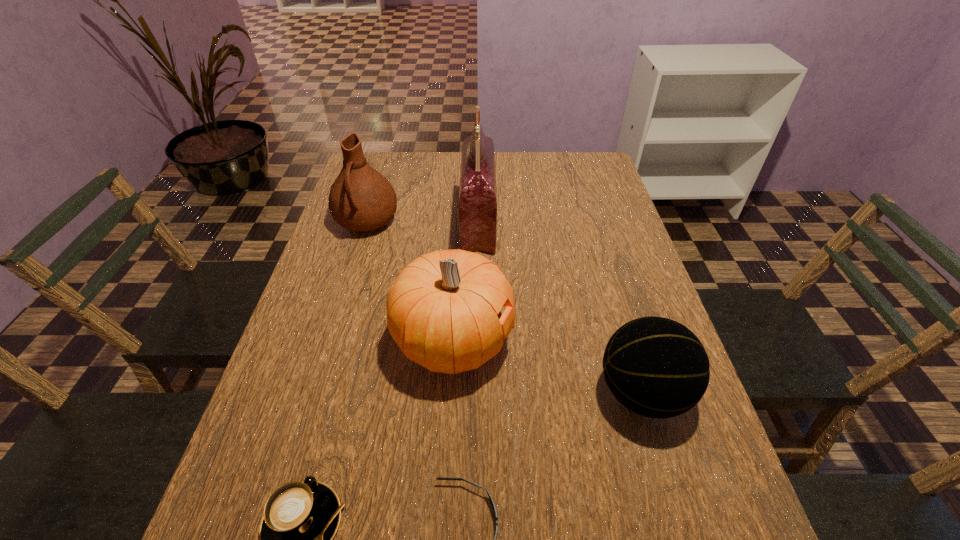
What are the coordinates of `object located in the right edge section of the desktop` in the screenshot? It's located at (656, 367).

Image resolution: width=960 pixels, height=540 pixels. Identify the location of free space at the far edge of the desktop. (430, 178).

Where is `vacant space at the left edge`? The width and height of the screenshot is (960, 540). vacant space at the left edge is located at coordinates (256, 514).

At what (x,y) coordinates should I click in order to perform the action: click on vacant space at the right edge of the desktop. Please return your answer as a coordinate pair (x, y). The width and height of the screenshot is (960, 540). Looking at the image, I should click on (701, 414).

Identify the location of empty space that is in between the tallest object and the rightmost object. The width and height of the screenshot is (960, 540). (560, 308).

The height and width of the screenshot is (540, 960). In order to click on vacant area between the basketball and the handbag in this screenshot , I will do `click(560, 308)`.

Point out which object is positioned as the nearest to the fourth tallest object. Please provide its 2D coordinates. Your answer should be formatted as a tuple, i.e. [(x, y)], where the tuple contains the x and y coordinates of a point satisfying the conditions above.

[(443, 311)]

Locate an element on the screen. Image resolution: width=960 pixels, height=540 pixels. object that stands as the third closest to the pitcher is located at coordinates (656, 367).

Identify the location of free spot that satisfies the following two spatial constraints: 1. on the front-facing side of the third shortest object; 2. on the left side of the handbag. This screenshot has width=960, height=540. (477, 393).